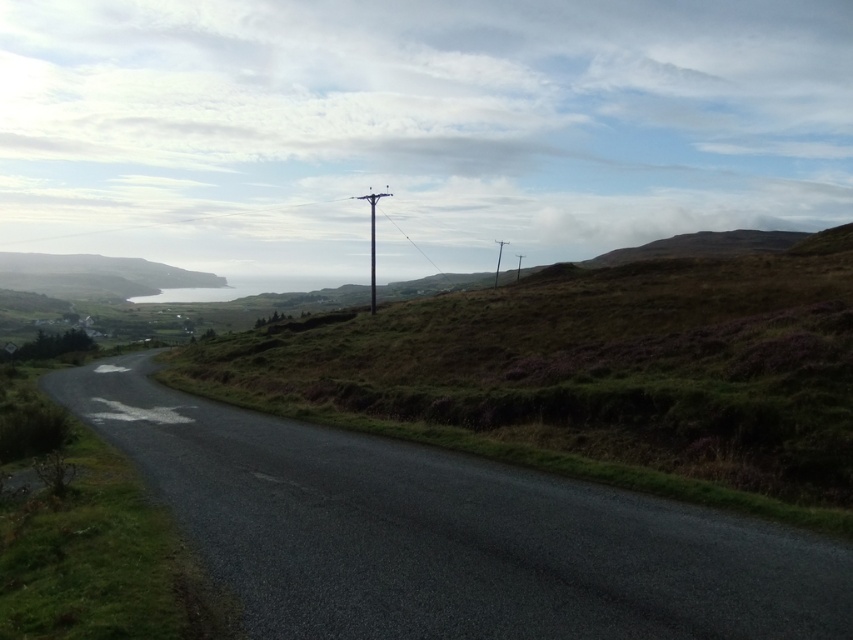
You are a hiker planning to cross the road. You see the green grassy at left and the metallic wire at upper center. Which one is smaller in size?

The green grassy at left is smaller in size compared to the metallic wire at upper center.